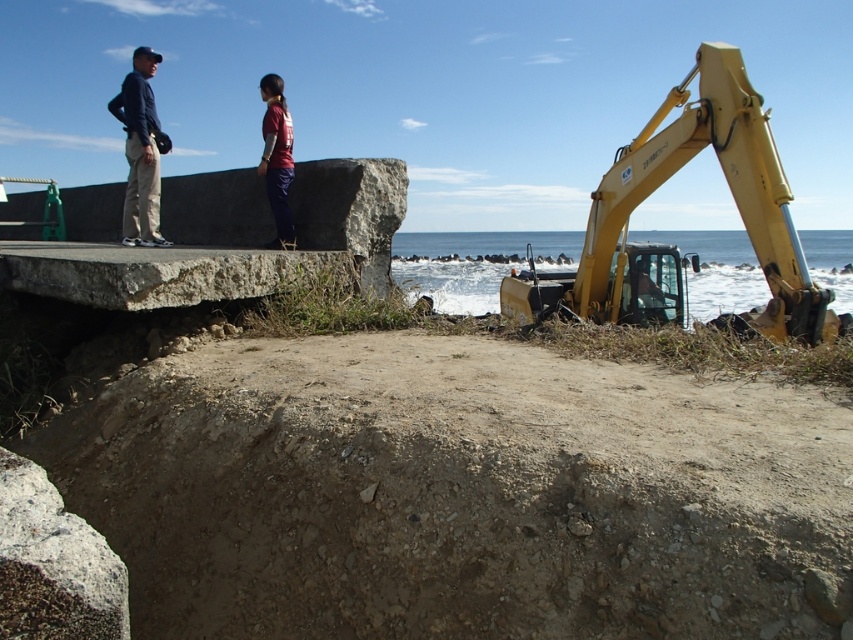
Is the position of yellow metallic excavator at right more distant than that of matte black clothing at upper left?

No.

Does yellow metallic excavator at right have a larger size compared to matte black clothing at upper left?

Yes.

Where is `yellow metallic excavator at right`? The width and height of the screenshot is (853, 640). yellow metallic excavator at right is located at coordinates point(663,180).

Find the location of `yellow metallic excavator at right`. yellow metallic excavator at right is located at coordinates (663, 180).

Does yellow metallic excavator at right appear over dark blue fabric jacket at upper left?

Incorrect, yellow metallic excavator at right is not positioned above dark blue fabric jacket at upper left.

Between yellow metallic excavator at right and dark blue fabric jacket at upper left, which one is positioned lower?

yellow metallic excavator at right is lower down.

Is point (618, 266) closer to camera compared to point (141, 81)?

No, (618, 266) is further to viewer.

Find the location of `yellow metallic excavator at right`. yellow metallic excavator at right is located at coordinates (663, 180).

Between point (132, 100) and point (134, 104), which one is positioned in front?

Point (134, 104) is more forward.

Between point (273, 179) and point (131, 195), which one is positioned behind?

Positioned behind is point (131, 195).

Is point (149, 225) more distant than point (144, 179)?

That is True.

Locate an element on the screen. The image size is (853, 640). matte black clothing at upper left is located at coordinates (138, 147).